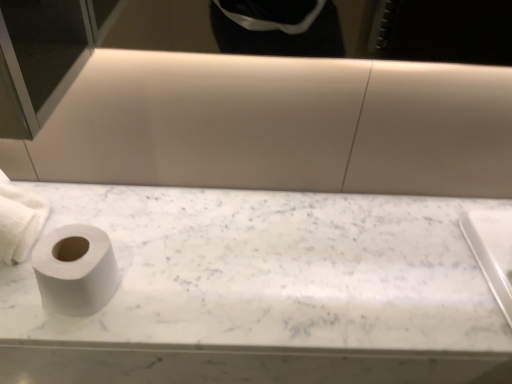
You are a GUI agent. You are given a task and a screenshot of the screen. Output one action in this format:
    pyautogui.click(x=<x>, y=<y>)
    Task: Click on the spots to the right of white matte toilet paper at left, which appears as the 1th toilet paper when viewed from the right
    This screenshot has width=512, height=384.
    Given the screenshot: What is the action you would take?
    (179, 285)